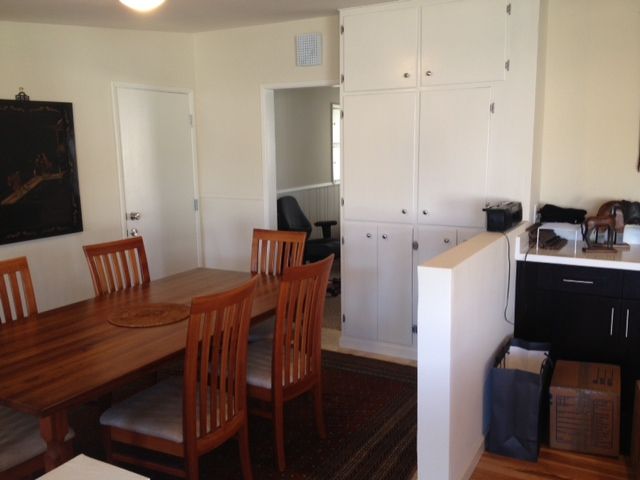
Where is `long brown rectangular dining room wed table`? The width and height of the screenshot is (640, 480). long brown rectangular dining room wed table is located at coordinates (97, 351).